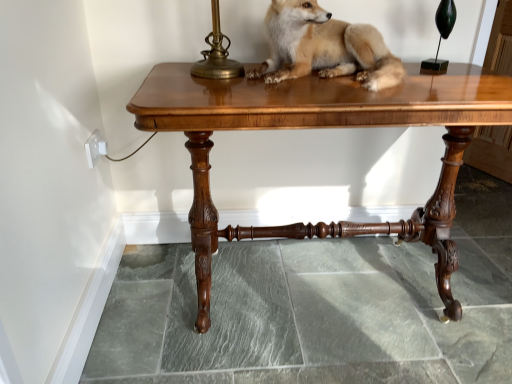
Where is `vacant location below glossy wood table at center (from a real-world perspective)`? This screenshot has height=384, width=512. vacant location below glossy wood table at center (from a real-world perspective) is located at coordinates (324, 283).